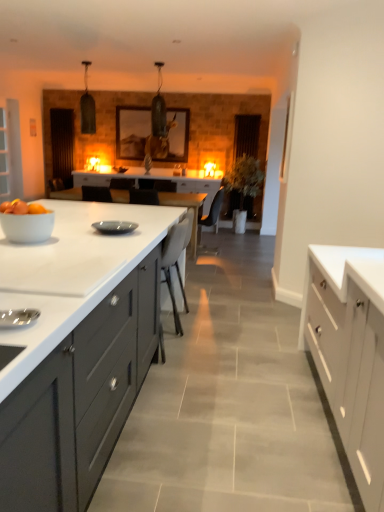
You are a GUI agent. You are given a task and a screenshot of the screen. Output one action in this format:
    pyautogui.click(x=<x>, y=<y>)
    Task: Click on the white glossy bowl at left
    
    Given the screenshot: What is the action you would take?
    pyautogui.click(x=27, y=226)

What is the approximate width of matte black glass door at upper left, the 1th glass door positioned from the right?

It is 14.58 centimeters.

What do you see at coordinates (10, 152) in the screenshot? The image size is (384, 512). I see `transparent glass door at left, the 2th glass door from the back` at bounding box center [10, 152].

What do you see at coordinates (187, 208) in the screenshot? I see `white glossy table at center` at bounding box center [187, 208].

Find the location of a particular element. matte gray cabinets at center, positioned as the 1th cabinetry in left-to-right order is located at coordinates (75, 350).

The height and width of the screenshot is (512, 384). I want to click on white glossy bowl at left, so click(22, 208).

The width and height of the screenshot is (384, 512). Identify the location of white glossy bowl at left. (27, 226).

In the scene shown: Are white glossy bowl at left and matte black glass door at upper left, placed as the 2th glass door when sorted from front to back, beside each other?

white glossy bowl at left is not next to matte black glass door at upper left, placed as the 2th glass door when sorted from front to back, and they're not touching.

Is white glossy bowl at left positioned with its back to matte black glass door at upper left, the 1th glass door positioned from the right?

No, white glossy bowl at left is not facing the opposite direction of matte black glass door at upper left, the 1th glass door positioned from the right.

From a real-world perspective, which object stands above the other?

In real-world perspective, matte black glass door at upper left, positioned as the second glass door in left-to-right order, is above.

Which is behind, point (50, 221) or point (53, 133)?

Point (53, 133)

Does white glossy bowl at left appear on the right side of transparent glass door at left, which is the first glass door from left to right?

Correct, you'll find white glossy bowl at left to the right of transparent glass door at left, which is the first glass door from left to right.

Is white glossy bowl at left turned away from transparent glass door at left, the 2th glass door positioned from the right?

No.

Which of these two, white glossy bowl at left or transparent glass door at left, which is the first glass door from left to right, is smaller?

With smaller size is white glossy bowl at left.

The height and width of the screenshot is (512, 384). Identify the location of the 1st glass door above the white glossy bowl at left (from the image's perspective). (10, 152).

Who is bigger, white wood cabinet at right, the 1th cabinetry from the right, or transparent glass door at left, which is the first glass door from left to right?

With larger size is white wood cabinet at right, the 1th cabinetry from the right.

Considering the relative positions of white wood cabinet at right, the 1th cabinetry from the right, and transparent glass door at left, which is the first glass door from left to right, in the image provided, is white wood cabinet at right, the 1th cabinetry from the right, to the right of transparent glass door at left, which is the first glass door from left to right, from the viewer's perspective?

Yes, white wood cabinet at right, the 1th cabinetry from the right, is to the right of transparent glass door at left, which is the first glass door from left to right.

Which object is closer to the camera, white wood cabinet at right, which is the second cabinetry in left-to-right order, or transparent glass door at left, the 2th glass door positioned from the right?

white wood cabinet at right, which is the second cabinetry in left-to-right order, is in front.

Which is further, (x=346, y=271) or (x=5, y=186)?

The point (x=5, y=186) is farther.

Is white wood cabinet at right, which is the second cabinetry in left-to-right order, at the left side of matte black glass door at upper left, positioned as the second glass door in left-to-right order?

No, white wood cabinet at right, which is the second cabinetry in left-to-right order, is not to the left of matte black glass door at upper left, positioned as the second glass door in left-to-right order.

Does white wood cabinet at right, the 1th cabinetry from the right, contain matte black glass door at upper left, the 1th glass door positioned from the right?

No.

Relative to matte black glass door at upper left, placed as the 2th glass door when sorted from front to back, is white wood cabinet at right, which is the second cabinetry in left-to-right order, in front or behind?

In the image, white wood cabinet at right, which is the second cabinetry in left-to-right order, appears in front of matte black glass door at upper left, placed as the 2th glass door when sorted from front to back.

Is there a large distance between white wood cabinet at right, the 1th cabinetry from the right, and matte black glass door at upper left, the 1th glass door positioned from the right?

Absolutely, white wood cabinet at right, the 1th cabinetry from the right, is distant from matte black glass door at upper left, the 1th glass door positioned from the right.

How far apart are white wood cabinet at right, which is the second cabinetry in left-to-right order, and white glossy bowl at left?

5.22 feet.

Which of these two, white wood cabinet at right, which is the second cabinetry in left-to-right order, or white glossy bowl at left, stands taller?

white wood cabinet at right, which is the second cabinetry in left-to-right order.

Is white wood cabinet at right, the 1th cabinetry from the right, oriented away from white glossy bowl at left?

No, white glossy bowl at left is not at the back of white wood cabinet at right, the 1th cabinetry from the right.

Are white wood cabinet at right, which is the second cabinetry in left-to-right order, and white glossy bowl at left far apart?

Yes, white wood cabinet at right, which is the second cabinetry in left-to-right order, is far from white glossy bowl at left.

Where is `plate behind the matte gray cabinets at center, positioned as the 1th cabinetry in left-to-right order`? This screenshot has height=512, width=384. plate behind the matte gray cabinets at center, positioned as the 1th cabinetry in left-to-right order is located at coordinates (115, 227).

Is matte gray cabinets at center, positioned as the 1th cabinetry in left-to-right order, further to camera compared to matte gray plate at center?

No, it is not.

Is point (63, 472) positioned in front of point (99, 227)?

Yes, point (63, 472) is closer to viewer.

Considering the relative positions of white fabric chair at center and transparent glass door at left, marked as the 1th glass door in a front-to-back arrangement, in the image provided, is white fabric chair at center to the right of transparent glass door at left, marked as the 1th glass door in a front-to-back arrangement, from the viewer's perspective?

Indeed, white fabric chair at center is positioned on the right side of transparent glass door at left, marked as the 1th glass door in a front-to-back arrangement.

Which of these two, white fabric chair at center or transparent glass door at left, which is the first glass door from left to right, is bigger?

With larger size is transparent glass door at left, which is the first glass door from left to right.

Measure the distance between white fabric chair at center and transparent glass door at left, the 2th glass door positioned from the right.

4.65 meters.

Is transparent glass door at left, the 2th glass door positioned from the right, at the back of white fabric chair at center?

No, transparent glass door at left, the 2th glass door positioned from the right, is not at the back of white fabric chair at center.

This screenshot has width=384, height=512. I want to click on bowl below the matte black glass door at upper left, positioned as the second glass door in left-to-right order (from a real-world perspective), so click(x=27, y=226).

Locate an element on the screen. The image size is (384, 512). the 1st glass door above the white glossy bowl at left (from the image's perspective) is located at coordinates (10, 152).

Considering their positions, is transparent glass door at left, the 2th glass door from the back, positioned further to white glossy bowl at left than white glossy table at center?

transparent glass door at left, the 2th glass door from the back, is further to white glossy bowl at left.

From the picture: Estimate the real-world distances between objects in this image. Which object is further from matte black glass door at upper left, which is counted as the first glass door, starting from the back, white wood cabinet at right, which is the second cabinetry in left-to-right order, or matte gray cabinets at center, the 2th cabinetry from the right?

white wood cabinet at right, which is the second cabinetry in left-to-right order, lies further to matte black glass door at upper left, which is counted as the first glass door, starting from the back, than the other object.

Looking at the image, which one is located closer to white glossy bowl at left, white fabric chair at center or white wood cabinet at right, the 1th cabinetry from the right?

The object closer to white glossy bowl at left is white fabric chair at center.

From the image, which object appears to be farther from transparent glass door at left, marked as the 1th glass door in a front-to-back arrangement, white wood cabinet at right, which is the second cabinetry in left-to-right order, or white glossy bowl at left?

Based on the image, white wood cabinet at right, which is the second cabinetry in left-to-right order, appears to be further to transparent glass door at left, marked as the 1th glass door in a front-to-back arrangement.

Estimate the real-world distances between objects in this image. Which object is closer to matte black glass door at upper left, which is counted as the first glass door, starting from the back, matte gray plate at center or matte gray cabinets at center, positioned as the 1th cabinetry in left-to-right order?

The object closer to matte black glass door at upper left, which is counted as the first glass door, starting from the back, is matte gray plate at center.

From the picture: When comparing their distances from white fabric chair at center, does matte black glass door at upper left, placed as the 2th glass door when sorted from front to back, or transparent glass door at left, the 2th glass door from the back, seem closer?

transparent glass door at left, the 2th glass door from the back, lies closer to white fabric chair at center than the other object.

Considering their positions, is transparent glass door at left, the 2th glass door from the back, positioned closer to white glossy table at center than white glossy bowl at left?

Based on the image, transparent glass door at left, the 2th glass door from the back, appears to be nearer to white glossy table at center.

Which object lies nearer to the anchor point transparent glass door at left, marked as the 1th glass door in a front-to-back arrangement, matte gray cabinets at center, positioned as the 1th cabinetry in left-to-right order, or white glossy bowl at left?

Based on the image, matte gray cabinets at center, positioned as the 1th cabinetry in left-to-right order, appears to be nearer to transparent glass door at left, marked as the 1th glass door in a front-to-back arrangement.

What are the coordinates of `chair between matte gray plate at center and white glossy table at center in the front-back direction` in the screenshot? It's located at [x=174, y=265].

Image resolution: width=384 pixels, height=512 pixels. I want to click on bowl between white glossy bowl at left and matte gray plate at center in the horizontal direction, so click(x=27, y=226).

Image resolution: width=384 pixels, height=512 pixels. I want to click on fruit between matte gray cabinets at center, the 2th cabinetry from the right, and matte gray plate at center from front to back, so click(x=22, y=208).

This screenshot has width=384, height=512. I want to click on bowl between matte gray cabinets at center, the 2th cabinetry from the right, and transparent glass door at left, which is the first glass door from left to right, in the front-back direction, so click(x=27, y=226).